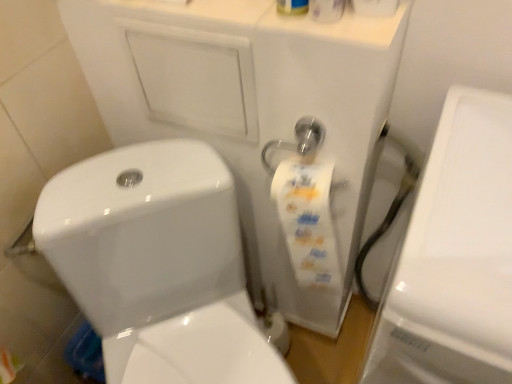
Question: Is white glossy toilet paper at upper center positioned behind white glossy toilet at center?

Choices:
 (A) yes
 (B) no

Answer: (B)

Question: Considering the relative sizes of white glossy toilet paper at upper center and white glossy toilet at center in the image provided, is white glossy toilet paper at upper center thinner than white glossy toilet at center?

Choices:
 (A) no
 (B) yes

Answer: (B)

Question: Does white glossy toilet paper at upper center have a lesser height compared to white glossy toilet at center?

Choices:
 (A) yes
 (B) no

Answer: (A)

Question: Can white glossy toilet at center be found inside white glossy toilet paper at upper center?

Choices:
 (A) yes
 (B) no

Answer: (B)

Question: Does white glossy toilet paper at upper center appear on the right side of white glossy toilet at center?

Choices:
 (A) no
 (B) yes

Answer: (B)

Question: Does point (410, 367) appear closer or farther from the camera than point (70, 228)?

Choices:
 (A) closer
 (B) farther

Answer: (A)

Question: Which is correct: white glossy porcelain at right is inside white glossy toilet at center, or outside of it?

Choices:
 (A) inside
 (B) outside

Answer: (B)

Question: In the image, is white glossy porcelain at right positioned in front of or behind white glossy toilet at center?

Choices:
 (A) behind
 (B) front

Answer: (B)

Question: From the image's perspective, relative to white glossy toilet at center, is white glossy porcelain at right above or below?

Choices:
 (A) below
 (B) above

Answer: (B)

Question: Which is correct: white glossy toilet paper at upper center is inside white glossy toilet at center, or outside of it?

Choices:
 (A) inside
 (B) outside

Answer: (B)

Question: Is point (x=379, y=6) positioned closer to the camera than point (x=204, y=182)?

Choices:
 (A) farther
 (B) closer

Answer: (B)

Question: From a real-world perspective, relative to white glossy toilet at center, is white glossy toilet paper at upper center vertically above or below?

Choices:
 (A) below
 (B) above

Answer: (B)

Question: Based on their sizes in the image, would you say white glossy toilet paper at upper center is bigger or smaller than white glossy toilet at center?

Choices:
 (A) small
 (B) big

Answer: (A)

Question: From the image's perspective, is white glossy toilet at center above or below white glossy toilet paper at upper center?

Choices:
 (A) above
 (B) below

Answer: (B)

Question: From their relative heights in the image, would you say white glossy toilet at center is taller or shorter than white glossy toilet paper at upper center?

Choices:
 (A) tall
 (B) short

Answer: (A)